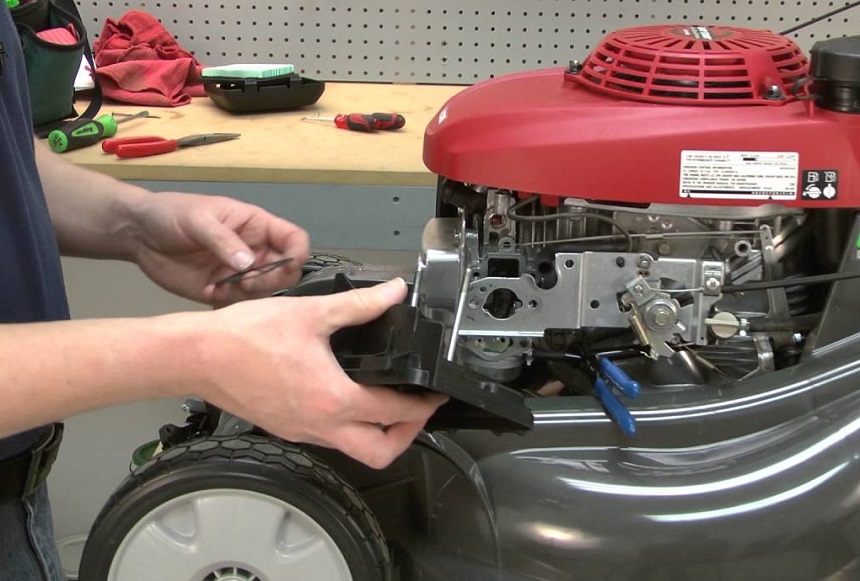
The width and height of the screenshot is (860, 581). What are the coordinates of `wood shelf` in the screenshot? It's located at (295, 150).